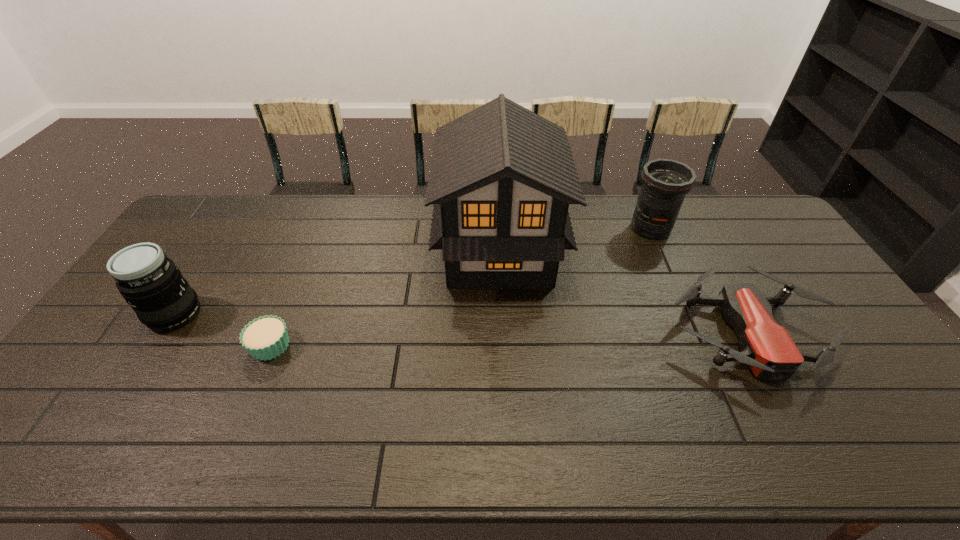
Locate an element on the screen. vacant space that is in between the right telephoto lens and the third object from left to right is located at coordinates (575, 240).

Where is `object that is the fourth closest to the leftmost object`? The width and height of the screenshot is (960, 540). object that is the fourth closest to the leftmost object is located at coordinates (665, 182).

This screenshot has height=540, width=960. I want to click on object that is the second nearest to the tallest object, so click(665, 182).